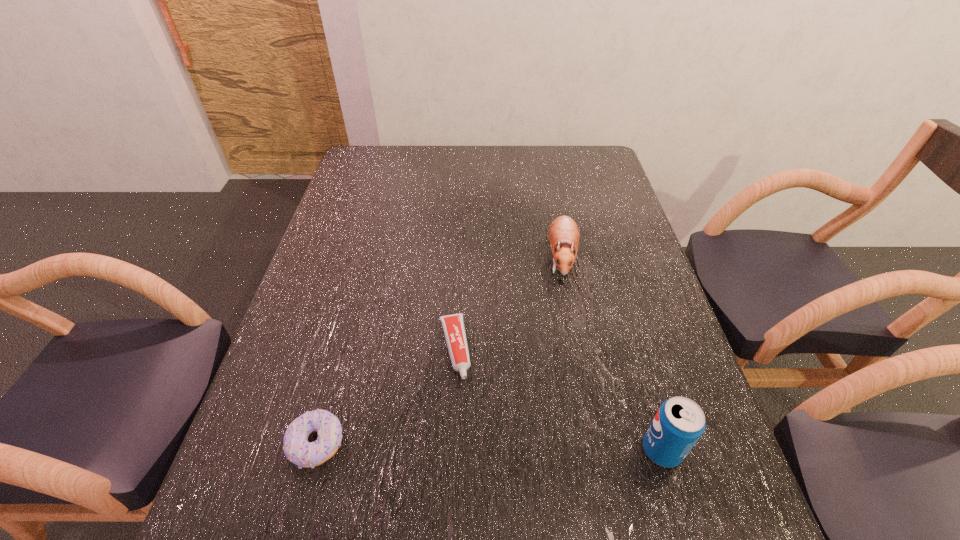
Locate an element on the screen. The image size is (960, 540). vacant space on the desktop that is between the leftmost object and the tallest object and is positioned at the nozzle of the third nearest object is located at coordinates point(474,447).

The width and height of the screenshot is (960, 540). I want to click on vacant space on the desktop that is between the doughnut and the soda can and is positioned at the face of the third shortest object, so [532, 448].